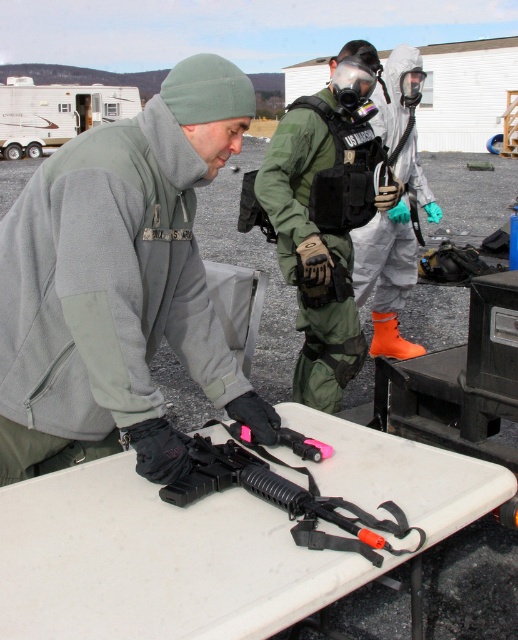
Question: Observing the image, what is the correct spatial positioning of green matte uniform at center in reference to black rubberized gun at center?

Choices:
 (A) above
 (B) below

Answer: (A)

Question: Which point is closer to the camera?

Choices:
 (A) orange rubber boots at center
 (B) green matte uniform at center
 (C) gray fleece jacket at center
 (D) black rubberized gun at center

Answer: (D)

Question: Which object is the closest to the black rubberized gun at center?

Choices:
 (A) gray fleece jacket at center
 (B) green matte uniform at center

Answer: (A)

Question: Can you confirm if gray fleece jacket at center is positioned below orange rubber boots at center?

Choices:
 (A) yes
 (B) no

Answer: (A)

Question: From the image, what is the correct spatial relationship of gray fleece jacket at center in relation to orange rubber boots at center?

Choices:
 (A) left
 (B) right

Answer: (A)

Question: Which point appears farthest from the camera in this image?

Choices:
 (A) (415, 186)
 (B) (324, 396)
 (C) (39, 177)

Answer: (A)